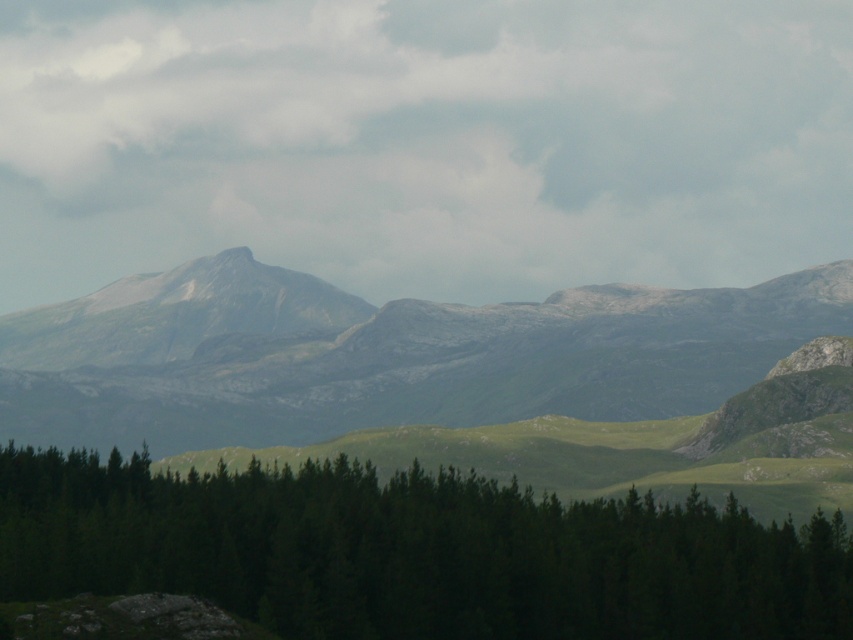
Question: Which object appears farthest from the camera in this image?

Choices:
 (A) green matte tree at center
 (B) gray rocky mountain range at center

Answer: (B)

Question: Is gray/cloudy sky at upper center further to camera compared to gray rocky mountain range at center?

Choices:
 (A) no
 (B) yes

Answer: (B)

Question: Among these points, which one is farthest from the camera?

Choices:
 (A) (273, 275)
 (B) (45, 480)
 (C) (584, 97)

Answer: (C)

Question: Is gray/cloudy sky at upper center closer to the viewer compared to gray rocky mountain range at center?

Choices:
 (A) no
 (B) yes

Answer: (A)

Question: Which point is farther from the camera taking this photo?

Choices:
 (A) coord(344,140)
 (B) coord(210,269)

Answer: (A)

Question: Does gray/cloudy sky at upper center have a larger size compared to green matte tree at center?

Choices:
 (A) yes
 (B) no

Answer: (A)